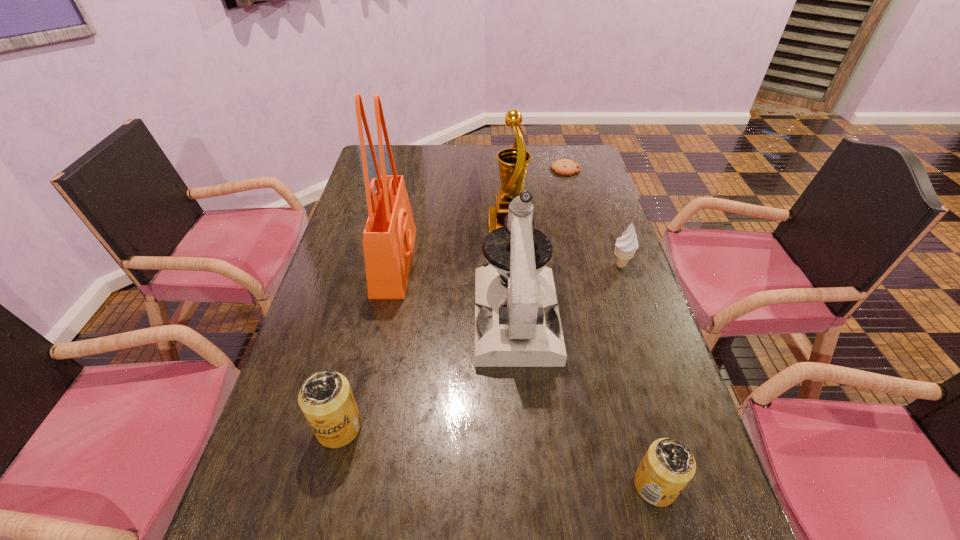
The height and width of the screenshot is (540, 960). In order to click on free location located 0.310m at the eyepiece of the microscope in this screenshot , I will do `click(531, 505)`.

Find the location of a particular element. This screenshot has width=960, height=540. object at the far edge is located at coordinates (565, 167).

At what (x,y) coordinates should I click in order to perform the action: click on object at the near edge. Please return your answer as a coordinate pair (x, y). This screenshot has height=540, width=960. Looking at the image, I should click on (668, 466).

You are a GUI agent. You are given a task and a screenshot of the screen. Output one action in this format:
    pyautogui.click(x=<x>, y=<y>)
    Task: Click on the beer can present at the left edge
    
    Given the screenshot: What is the action you would take?
    pyautogui.click(x=325, y=398)

Find the location of a particular element. This screenshot has height=540, width=960. tote bag positioned at the left edge is located at coordinates (388, 239).

I want to click on beer can that is positioned at the right edge, so click(668, 466).

This screenshot has width=960, height=540. What are the coordinates of `cookie located in the right edge section of the desktop` in the screenshot? It's located at (565, 167).

Where is `icecream at the right edge`? icecream at the right edge is located at coordinates (626, 245).

At what (x,y) coordinates should I click in order to perform the action: click on object located in the far right corner section of the desktop. Please return your answer as a coordinate pair (x, y). Looking at the image, I should click on (565, 167).

What are the coordinates of `object at the near right corner` in the screenshot? It's located at (668, 466).